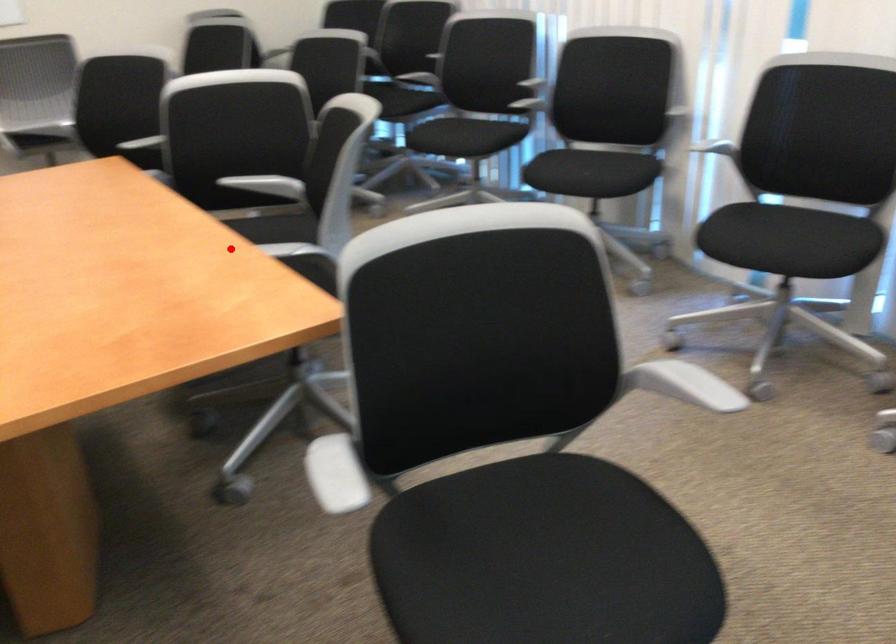
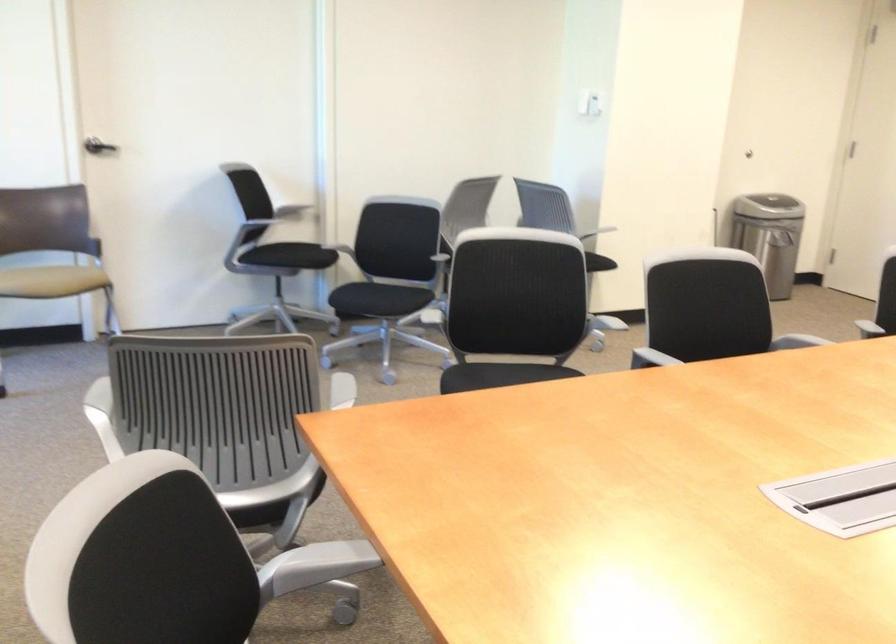
In the second image, find the point that corresponds to the highlighted location in the first image.

(320, 562)